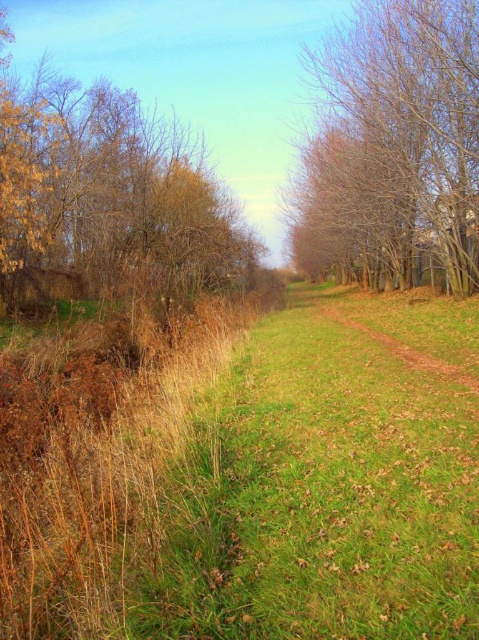
Question: Estimate the real-world distances between objects in this image. Which object is closer to the brown dry grass at left?

Choices:
 (A) green grassy trail at center
 (B) bare branches at center

Answer: (B)

Question: Which of the following is the farthest from the observer?

Choices:
 (A) brown dry grass at left
 (B) green grassy trail at center
 (C) bare branches at center

Answer: (A)

Question: Can you confirm if brown dry grass at left is wider than bare branches at center?

Choices:
 (A) yes
 (B) no

Answer: (A)

Question: Where is green grassy trail at center located in relation to yellowish-brown textured tree at left in the image?

Choices:
 (A) above
 (B) below

Answer: (B)

Question: Is brown dry grass at left further to camera compared to bare branches at center?

Choices:
 (A) no
 (B) yes

Answer: (B)

Question: Which object is positioned farthest from the bare branches at center?

Choices:
 (A) green grassy trail at center
 (B) brown dry grass at left
 (C) yellowish-brown textured tree at left

Answer: (C)